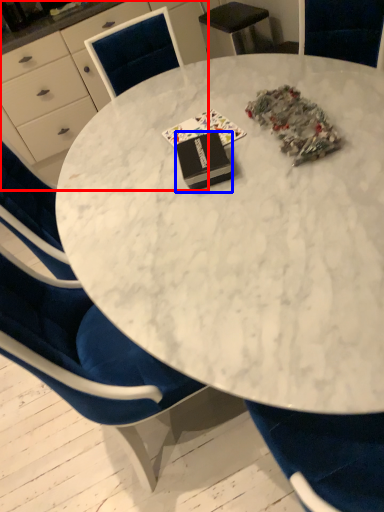
Question: Which of the following is the closest to the observer, desk (highlighted by a red box) or book (highlighted by a blue box)?

Choices:
 (A) desk
 (B) book

Answer: (B)